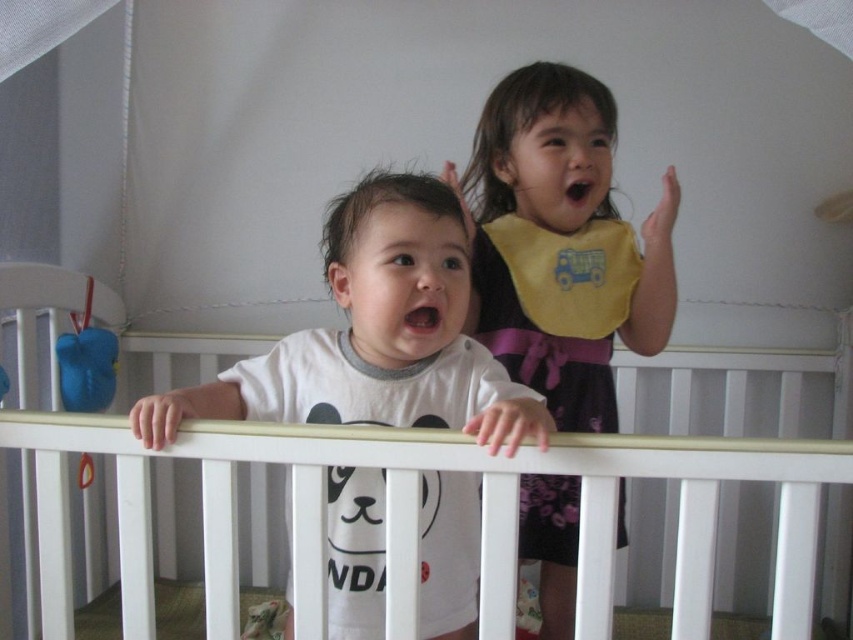
Question: Can you confirm if white matte shirt at center is wider than yellow fabric bib at upper right?

Choices:
 (A) yes
 (B) no

Answer: (A)

Question: Which of the following is the farthest from the observer?

Choices:
 (A) tap(648, 221)
 (B) tap(62, 356)
 (C) tap(299, 493)

Answer: (B)

Question: Which object is positioned closest to the yellow fabric bib at upper center?

Choices:
 (A) blue rubber duck at left
 (B) yellow fabric bib at upper right
 (C) white matte shirt at center
 (D) white wooden crib at center

Answer: (B)

Question: Which point is farther to the camera?

Choices:
 (A) (44, 548)
 (B) (88, 454)
 (C) (560, 342)
 (D) (357, 394)

Answer: (B)

Question: Can you confirm if white matte shirt at center is positioned above blue rubber duck at left?

Choices:
 (A) yes
 (B) no

Answer: (B)

Question: Can you confirm if white wooden crib at center is positioned above white matte shirt at center?

Choices:
 (A) no
 (B) yes

Answer: (A)